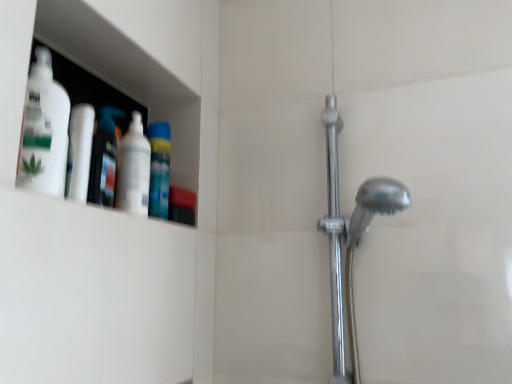
Question: Would you say white glossy bottle at left, which ranks as the 1th mouthwash in left-to-right order, is to the left or to the right of blue matte mouthwash at upper left, the first mouthwash from the back, in the picture?

Choices:
 (A) right
 (B) left

Answer: (B)

Question: Is point (90, 142) closer or farther from the camera than point (165, 173)?

Choices:
 (A) farther
 (B) closer

Answer: (B)

Question: Considering the real-world distances, which object is farthest from the polished chrome shower door at right?

Choices:
 (A) white matte bottle at upper left, the first cleaning product from the front
 (B) white glossy bottle at left, marked as the 1th mouthwash in a front-to-back arrangement
 (C) blue matte mouthwash at upper left, the second mouthwash positioned from the left
 (D) translucent plastic bottle at left, acting as the second cleaning product starting from the back
 (E) white glossy bottle at upper left, marked as the third cleaning product in a front-to-back arrangement

Answer: (A)

Question: Estimate the real-world distances between objects in this image. Which object is farther from the blue matte mouthwash at upper left, the first mouthwash from the back?

Choices:
 (A) translucent plastic bottle at left, the 2th cleaning product from the front
 (B) polished chrome shower door at right
 (C) white glossy bottle at upper left, marked as the third cleaning product in a front-to-back arrangement
 (D) white glossy bottle at left, acting as the 2th mouthwash starting from the back
 (E) white matte bottle at upper left, the 3th cleaning product when ordered from back to front

Answer: (B)